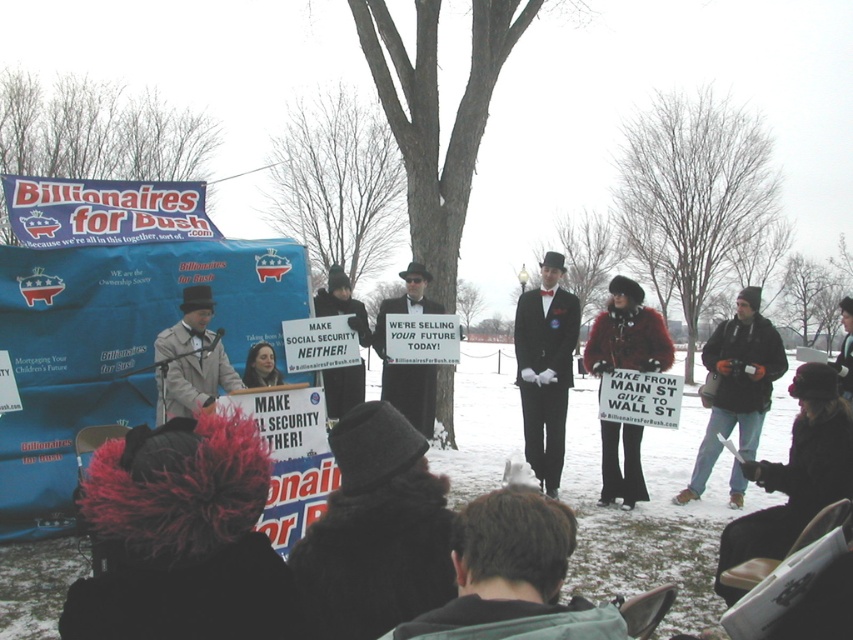
Question: Considering the relative positions of shiny black suit at center and black suit coat at center in the image provided, where is shiny black suit at center located with respect to black suit coat at center?

Choices:
 (A) left
 (B) right

Answer: (B)

Question: Is black wool jacket at lower right to the left of black suit coat at center from the viewer's perspective?

Choices:
 (A) no
 (B) yes

Answer: (A)

Question: Can you confirm if matte gray coat at center is positioned above black suit coat at center?

Choices:
 (A) yes
 (B) no

Answer: (B)

Question: Which object appears farthest from the camera in this image?

Choices:
 (A) black suit coat at center
 (B) matte gray coat at center
 (C) shiny black suit at center

Answer: (A)

Question: Among these objects, which one is nearest to the camera?

Choices:
 (A) black suit coat at center
 (B) matte gray coat at center
 (C) black wool jacket at lower right

Answer: (B)

Question: Which of the following is the farthest from the observer?

Choices:
 (A) (189, 291)
 (B) (415, 376)
 (C) (738, 440)
 (D) (555, 388)

Answer: (B)